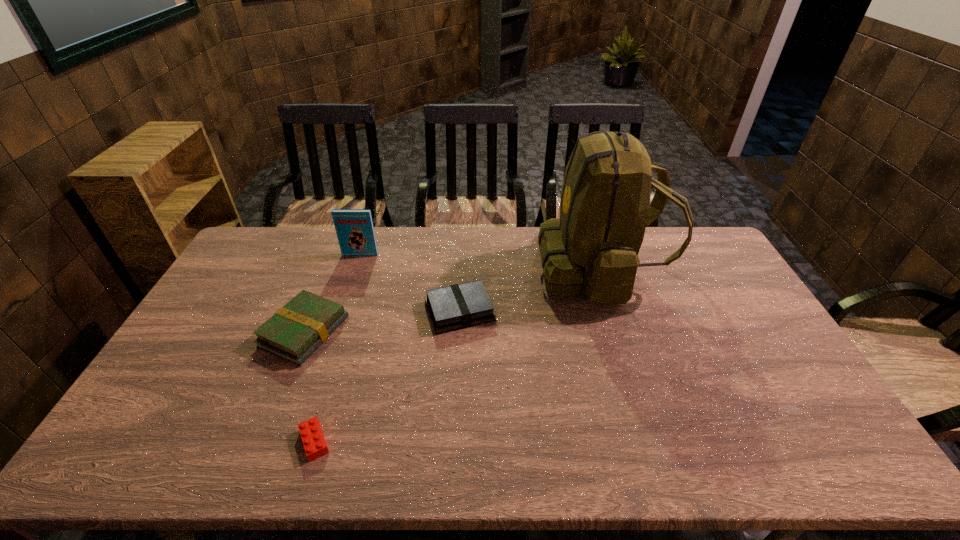
Find the location of a particular element. This screenshot has height=540, width=960. free spot located 0.320m on the front cover of the second tallest object is located at coordinates (339, 320).

The image size is (960, 540). In order to click on free space located on the back of the rightmost book in this screenshot , I will do `click(464, 240)`.

This screenshot has height=540, width=960. I want to click on free region located 0.330m on the right of the nearest object, so click(x=468, y=442).

Locate an element on the screen. The height and width of the screenshot is (540, 960). backpack that is at the far edge is located at coordinates (593, 247).

The width and height of the screenshot is (960, 540). What are the coordinates of `book present at the far edge` in the screenshot? It's located at (354, 227).

In order to click on object positioned at the near edge in this screenshot , I will do `click(315, 446)`.

The image size is (960, 540). In the image, there is a desktop. What are the coordinates of `vacant space at the far edge` in the screenshot? It's located at (647, 243).

Find the location of a particular element. vacant region at the near edge of the desktop is located at coordinates (732, 438).

Identify the location of vacant space at the left edge of the desktop. This screenshot has width=960, height=540. (227, 310).

At what (x,y) coordinates should I click in order to perform the action: click on free space at the right edge of the desktop. Please return your answer as a coordinate pair (x, y). Image resolution: width=960 pixels, height=540 pixels. Looking at the image, I should click on (802, 395).